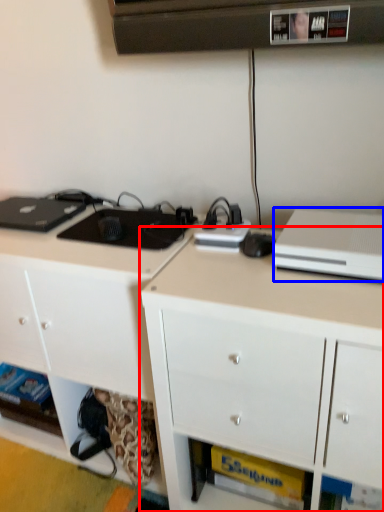
Question: Which of the following is the farthest to the observer, cabinetry (highlighted by a red box) or desktop computer (highlighted by a blue box)?

Choices:
 (A) cabinetry
 (B) desktop computer

Answer: (B)